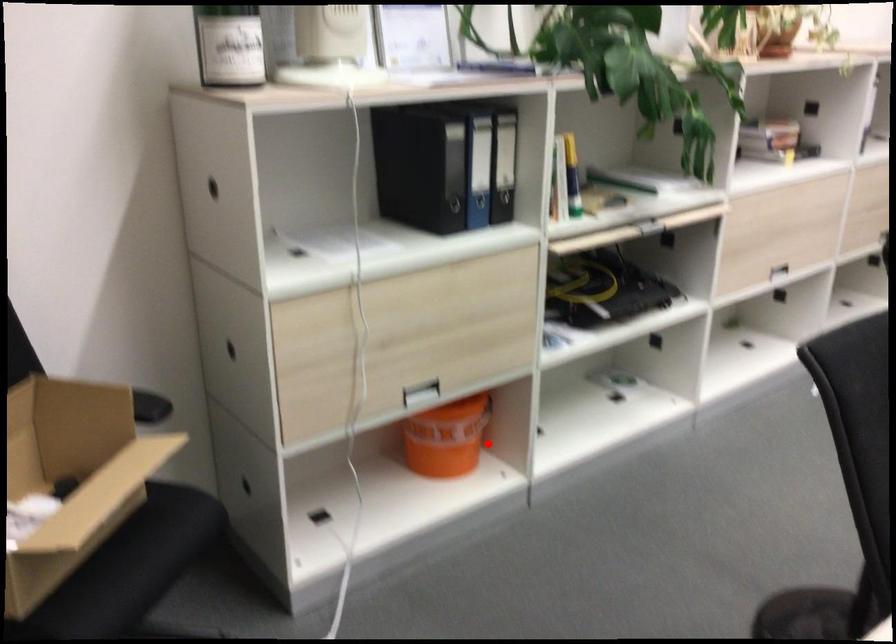
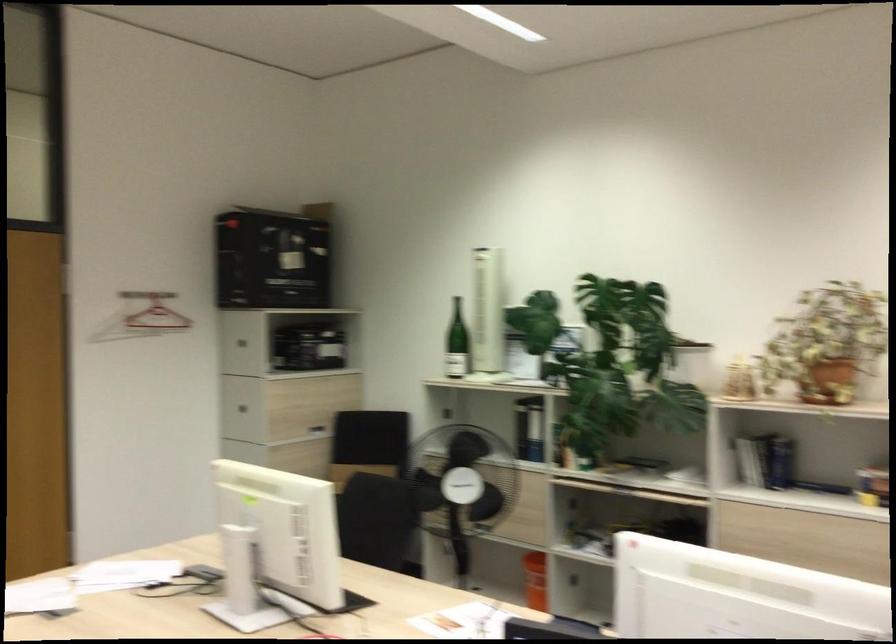
Locate, in the second image, the point that corresponds to the highlighted location in the first image.

(535, 580)